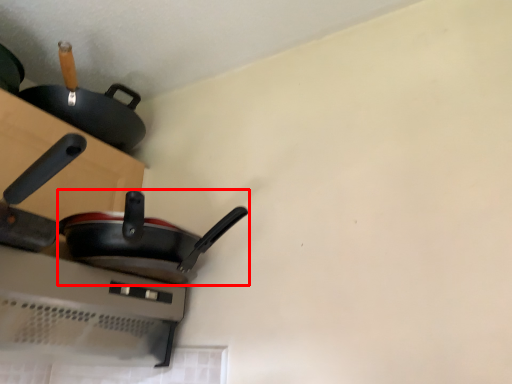
Question: From the image, what is the correct spatial relationship of frying pan (annotated by the red box) in relation to frying pan?

Choices:
 (A) right
 (B) left

Answer: (A)